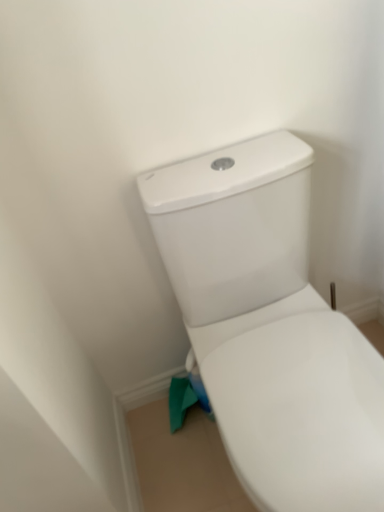
What do you see at coordinates (269, 327) in the screenshot? The width and height of the screenshot is (384, 512). I see `white glossy toilet at center` at bounding box center [269, 327].

Image resolution: width=384 pixels, height=512 pixels. In order to click on white glossy toilet at center in this screenshot , I will do `click(269, 327)`.

Locate an element on the screen. The width and height of the screenshot is (384, 512). white glossy toilet at center is located at coordinates coord(269,327).